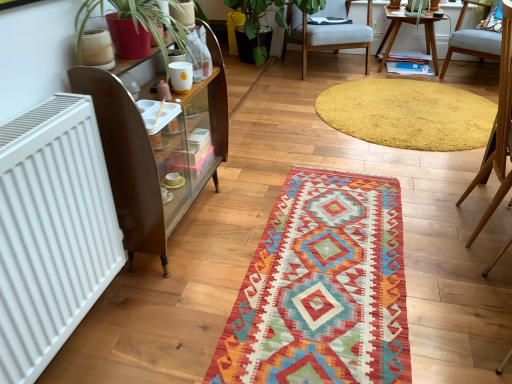
Where is `vacant area that lies between light blue fabric chair at right, which is the 1th chair from front to back, and multicolored woven mat at center, the first mat when ordered from front to back`? Image resolution: width=512 pixels, height=384 pixels. vacant area that lies between light blue fabric chair at right, which is the 1th chair from front to back, and multicolored woven mat at center, the first mat when ordered from front to back is located at coordinates (433, 256).